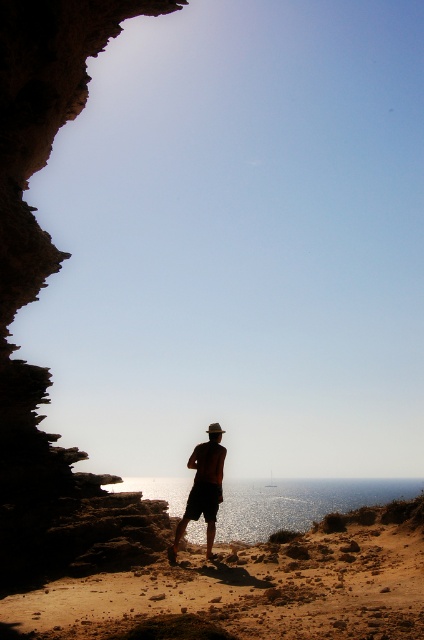
Find the location of a particular element. The width and height of the screenshot is (424, 640). brown sandy beach at lower center is located at coordinates (243, 588).

Describe the element at coordinates (243, 588) in the screenshot. I see `brown sandy beach at lower center` at that location.

The width and height of the screenshot is (424, 640). Describe the element at coordinates (243, 588) in the screenshot. I see `brown sandy beach at lower center` at that location.

The height and width of the screenshot is (640, 424). Identify the location of brown sandy beach at lower center. (243, 588).

Is brown sandy beach at lower center wider than silhouette hat at center?

Correct, the width of brown sandy beach at lower center exceeds that of silhouette hat at center.

Between brown sandy beach at lower center and silhouette hat at center, which one appears on the left side from the viewer's perspective?

silhouette hat at center is more to the left.

What do you see at coordinates (243, 588) in the screenshot? I see `brown sandy beach at lower center` at bounding box center [243, 588].

Find the location of a particular element. The height and width of the screenshot is (640, 424). brown sandy beach at lower center is located at coordinates [x=243, y=588].

In the scene shown: Measure the distance from dark brown rocky cliff at left to silhouette hat at center.

dark brown rocky cliff at left is 5.58 meters from silhouette hat at center.

Is dark brown rocky cliff at left thinner than silhouette hat at center?

In fact, dark brown rocky cliff at left might be wider than silhouette hat at center.

The image size is (424, 640). In order to click on dark brown rocky cliff at left in this screenshot , I will do `click(39, 250)`.